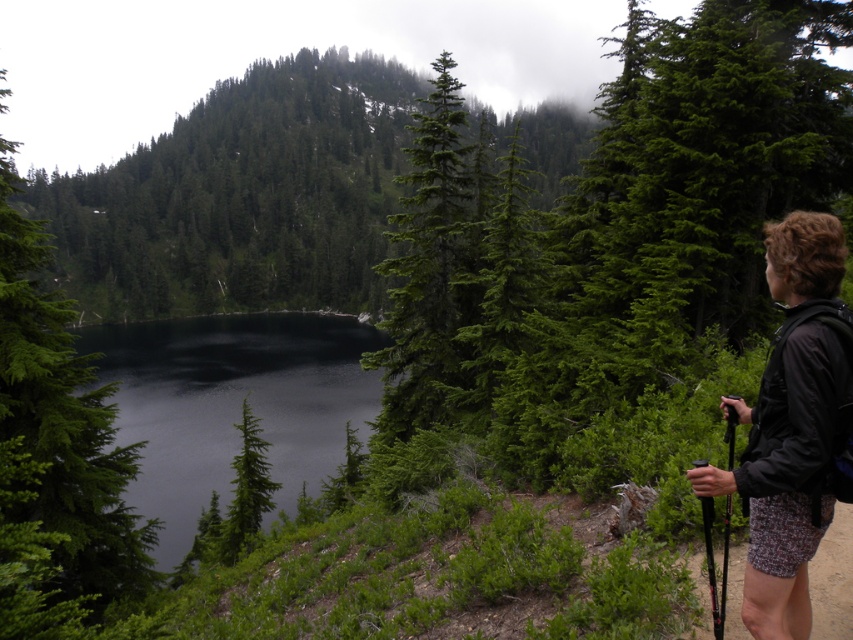
Question: Considering the real-world distances, which object is closest to the green evergreen tree at upper center?

Choices:
 (A) green matte tree at left
 (B) dark reflective water at center
 (C) dark brown fabric jacket at right

Answer: (B)

Question: Which point is closer to the camera?

Choices:
 (A) dark reflective water at center
 (B) dark brown fabric jacket at right
 (C) green matte tree at left

Answer: (B)

Question: Estimate the real-world distances between objects in this image. Which object is closer to the green evergreen tree at upper center?

Choices:
 (A) dark reflective water at center
 (B) green matte tree at left

Answer: (A)

Question: Can you confirm if green evergreen tree at upper center is positioned above dark brown fabric jacket at right?

Choices:
 (A) yes
 (B) no

Answer: (A)

Question: Is dark reflective water at center below dark brown fabric jacket at right?

Choices:
 (A) no
 (B) yes

Answer: (B)

Question: Is green evergreen tree at upper center to the right of green matte tree at left from the viewer's perspective?

Choices:
 (A) no
 (B) yes

Answer: (B)